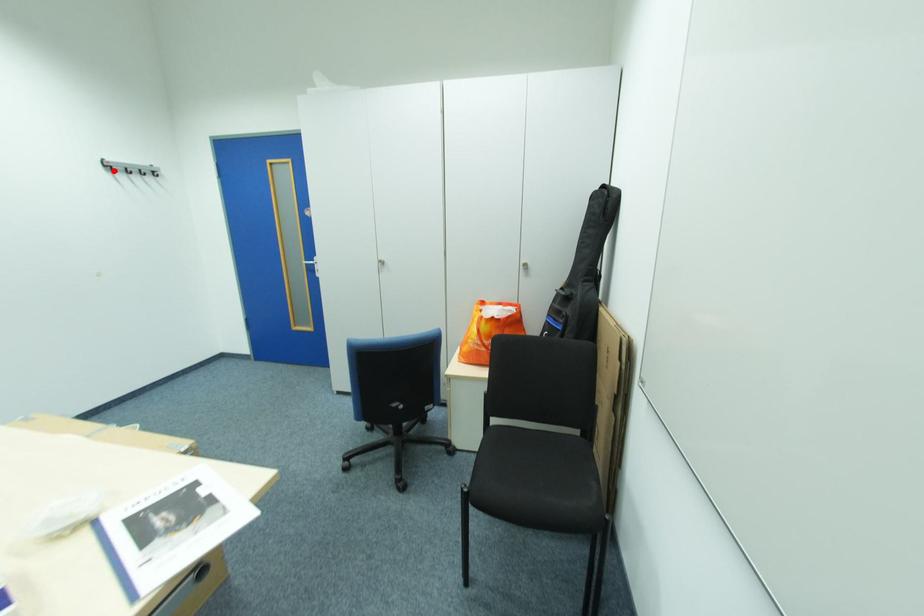
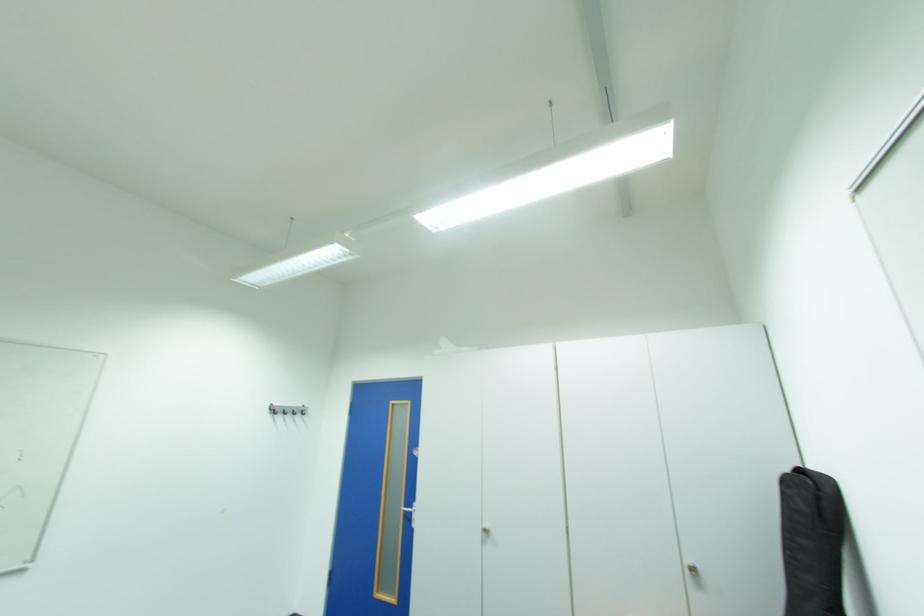
Question: I am providing you with two images of the same scene from different viewpoints. A red point is marked on the first image. Is the red point's position out of view in image 2?

Choices:
 (A) Yes
 (B) No

Answer: (B)